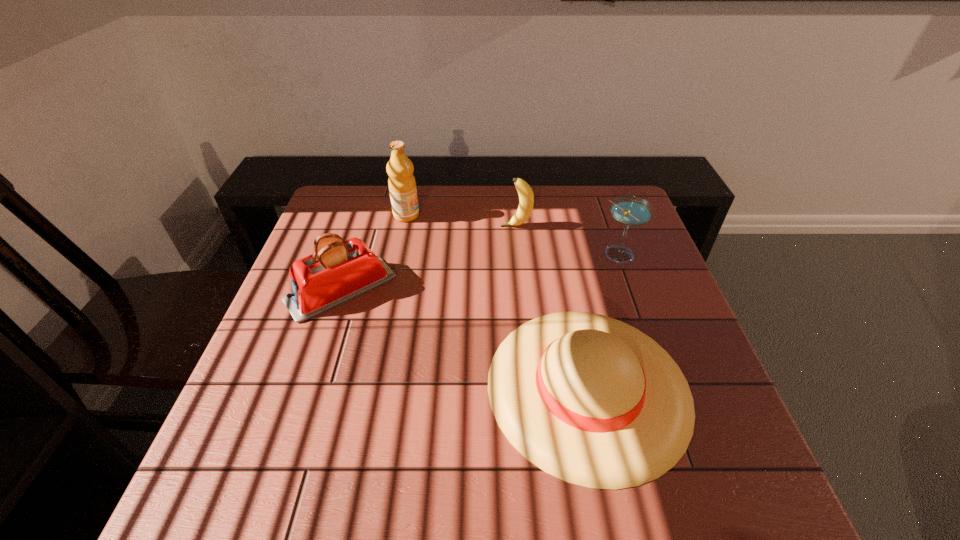
Identify the location of free space at the near edge of the desktop. Image resolution: width=960 pixels, height=540 pixels. (586, 513).

You are a GUI agent. You are given a task and a screenshot of the screen. Output one action in this format:
    pyautogui.click(x=<x>, y=<y>)
    Task: Click on the free space at the left edge of the desktop
    This screenshot has width=960, height=540.
    Given the screenshot: What is the action you would take?
    pyautogui.click(x=310, y=242)

This screenshot has width=960, height=540. What are the coordinates of `free spot at the right edge of the desktop` in the screenshot? It's located at (668, 342).

This screenshot has width=960, height=540. In order to click on free space at the far left corner in this screenshot , I will do `click(366, 226)`.

In the image, there is a desktop. Where is `vacant area at the far right corner`? The height and width of the screenshot is (540, 960). vacant area at the far right corner is located at coordinates (612, 194).

Image resolution: width=960 pixels, height=540 pixels. I want to click on free space at the near right corner of the desktop, so click(x=694, y=482).

Identify the location of free area in between the sombrero and the tallest object. (497, 301).

At what (x,y) coordinates should I click in order to perform the action: click on free area in between the banana and the toaster. Please return your answer as a coordinate pair (x, y). Image resolution: width=960 pixels, height=540 pixels. Looking at the image, I should click on (428, 258).

This screenshot has width=960, height=540. I want to click on vacant area that lies between the sombrero and the banana, so click(x=552, y=306).

The image size is (960, 540). Find the location of `vacant point located between the banana and the fruit juice`. vacant point located between the banana and the fruit juice is located at coordinates (461, 221).